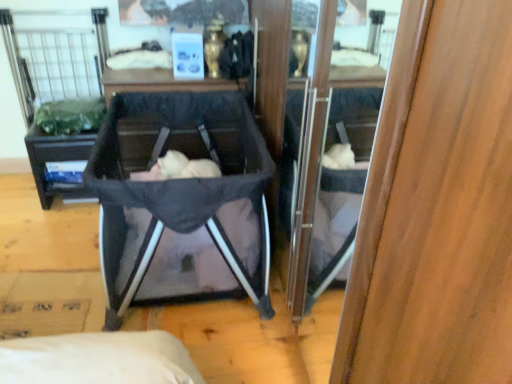
At what (x,y) coordinates should I click in order to perform the action: click on dark gray fabric baby carriage at center. Please return your answer as a coordinate pair (x, y). Image resolution: width=512 pixels, height=384 pixels. Looking at the image, I should click on (181, 200).

Considering the positions of objects black matte vanity at center and wooden cabinet at center in the image provided, who is more to the left, black matte vanity at center or wooden cabinet at center?

black matte vanity at center is more to the left.

Do you think black matte vanity at center is within wooden cabinet at center, or outside of it?

black matte vanity at center exists outside the volume of wooden cabinet at center.

In terms of width, does black matte vanity at center look wider or thinner when compared to wooden cabinet at center?

In the image, black matte vanity at center appears to be wider than wooden cabinet at center.

From the image's perspective, does black matte vanity at center appear lower than wooden cabinet at center?

No.

Between wooden cabinet at center and black matte vanity at center, which one has larger width?

black matte vanity at center.

You are a GUI agent. You are given a task and a screenshot of the screen. Output one action in this format:
    pyautogui.click(x=<x>, y=<y>)
    Task: Click on the wood below the black matte vanity at center (from the image's perspective)
    
    Given the screenshot: What is the action you would take?
    pyautogui.click(x=437, y=207)

Considering their positions, is wooden cabinet at center located in front of or behind black matte vanity at center?

Visually, wooden cabinet at center is located in front of black matte vanity at center.

This screenshot has width=512, height=384. Find the location of `vanity beneath the soft pink fabric at center (from a real-world perspective)`. vanity beneath the soft pink fabric at center (from a real-world perspective) is located at coordinates (58, 161).

Does black matte vanity at center contain soft pink fabric at center?

No, soft pink fabric at center is not inside black matte vanity at center.

Does black matte vanity at center have a smaller size compared to soft pink fabric at center?

Yes, black matte vanity at center is smaller than soft pink fabric at center.

Based on the photo, from a real-world perspective, which is physically above, black matte vanity at center or soft pink fabric at center?

In real-world perspective, soft pink fabric at center is above.

Is dark gray fabric baby carriage at center bigger or smaller than soft pink fabric at center?

Clearly, dark gray fabric baby carriage at center is larger in size than soft pink fabric at center.

Is dark gray fabric baby carriage at center aimed at soft pink fabric at center?

Yes, dark gray fabric baby carriage at center faces towards soft pink fabric at center.

From the image's perspective, which one is positioned lower, dark gray fabric baby carriage at center or soft pink fabric at center?

soft pink fabric at center, from the image's perspective.

Is wooden cabinet at center with dark gray fabric baby carriage at center?

They are not placed beside each other.

Which object is further away from the camera taking this photo, wooden cabinet at center or dark gray fabric baby carriage at center?

dark gray fabric baby carriage at center.

From a real-world perspective, which object stands above the other?

wooden cabinet at center.

Considering the sizes of wooden cabinet at center and dark gray fabric baby carriage at center in the image, is wooden cabinet at center wider or thinner than dark gray fabric baby carriage at center?

In the image, wooden cabinet at center appears to be more narrow than dark gray fabric baby carriage at center.

Looking at this image, is wooden cabinet at center looking in the opposite direction of soft pink fabric at center?

Yes, wooden cabinet at center is facing away from soft pink fabric at center.

Are wooden cabinet at center and soft pink fabric at center far apart?

That's not correct — wooden cabinet at center is a little close to soft pink fabric at center.

Can you tell me how much wooden cabinet at center and soft pink fabric at center differ in facing direction?

The angle between the facing direction of wooden cabinet at center and the facing direction of soft pink fabric at center is 0.104 degrees.

Does wooden cabinet at center have a greater width compared to soft pink fabric at center?

Incorrect, the width of wooden cabinet at center does not surpass that of soft pink fabric at center.

Is black matte vanity at center taller or shorter than dark gray fabric baby carriage at center?

Considering their sizes, black matte vanity at center has less height than dark gray fabric baby carriage at center.

Looking at this image, is dark gray fabric baby carriage at center completely or partially inside black matte vanity at center?

No, dark gray fabric baby carriage at center is not inside black matte vanity at center.

From the picture: Measure the distance between black matte vanity at center and dark gray fabric baby carriage at center.

black matte vanity at center is 69.72 centimeters from dark gray fabric baby carriage at center.

Is black matte vanity at center turned away from dark gray fabric baby carriage at center?

No, black matte vanity at center is not facing the opposite direction of dark gray fabric baby carriage at center.

Identify the location of wood below the black matte vanity at center (from the image's perspective). This screenshot has height=384, width=512. (437, 207).

You are a GUI agent. You are given a task and a screenshot of the screen. Output one action in this format:
    pyautogui.click(x=<x>, y=<y>)
    Task: Click on the wood on the right of black matte vanity at center
    The image size is (512, 384).
    Given the screenshot: What is the action you would take?
    pyautogui.click(x=437, y=207)

Looking at this image, estimate the real-world distances between objects in this image. Which object is further from dark gray fabric baby carriage at center, black matte vanity at center or soft pink fabric at center?

black matte vanity at center.

Estimate the real-world distances between objects in this image. Which object is further from black matte vanity at center, wooden cabinet at center or soft pink fabric at center?

wooden cabinet at center.

Considering their positions, is soft pink fabric at center positioned closer to black matte vanity at center than dark gray fabric baby carriage at center?

dark gray fabric baby carriage at center is positioned closer to the anchor black matte vanity at center.

Considering their positions, is black matte vanity at center positioned closer to soft pink fabric at center than wooden cabinet at center?

Based on the image, wooden cabinet at center appears to be nearer to soft pink fabric at center.

Considering their positions, is dark gray fabric baby carriage at center positioned further to soft pink fabric at center than wooden cabinet at center?

The object further to soft pink fabric at center is wooden cabinet at center.

Based on the photo, estimate the real-world distances between objects in this image. Which object is further from dark gray fabric baby carriage at center, black matte vanity at center or wooden cabinet at center?

Based on the image, wooden cabinet at center appears to be further to dark gray fabric baby carriage at center.

From the image, which object appears to be nearer to soft pink fabric at center, black matte vanity at center or dark gray fabric baby carriage at center?

dark gray fabric baby carriage at center is positioned closer to the anchor soft pink fabric at center.

Looking at this image, which object lies further to the anchor point soft pink fabric at center, wooden cabinet at center or black matte vanity at center?

black matte vanity at center lies further to soft pink fabric at center than the other object.

Identify the location of baby carriage between black matte vanity at center and soft pink fabric at center in the horizontal direction. (181, 200).

The height and width of the screenshot is (384, 512). What are the coordinates of `baby carriage between wooden cabinet at center and black matte vanity at center in the front-back direction` in the screenshot? It's located at (181, 200).

The image size is (512, 384). In order to click on baby located between wooden cabinet at center and black matte vanity at center in the depth direction in this screenshot , I will do `click(194, 259)`.

Where is `baby carriage between wooden cabinet at center and soft pink fabric at center in the front-back direction`? This screenshot has width=512, height=384. baby carriage between wooden cabinet at center and soft pink fabric at center in the front-back direction is located at coordinates (181, 200).